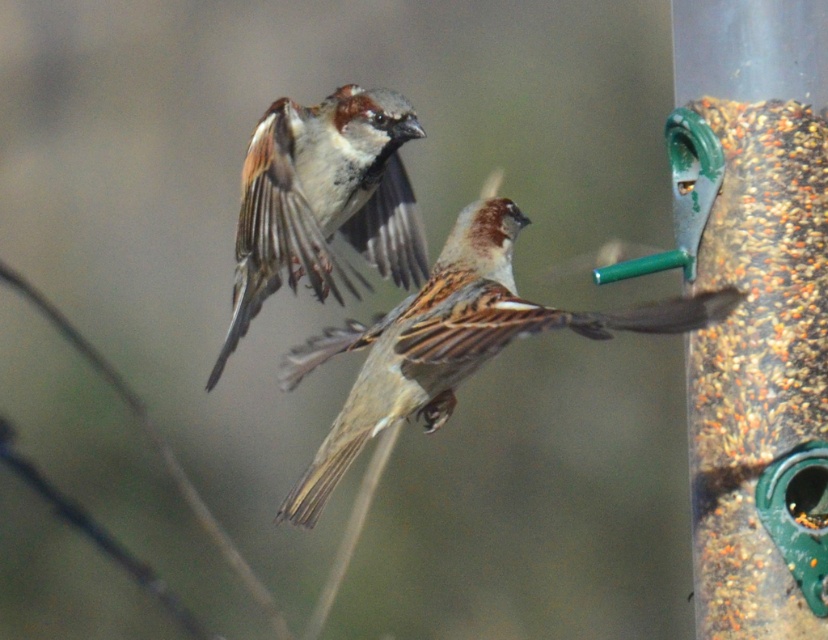
Based on the photo, between brown feathered sparrow at center and brown feathered sparrow at upper center, which one has more height?

Standing taller between the two is brown feathered sparrow at upper center.

Between point (407, 353) and point (384, 240), which one is positioned in front?

Point (407, 353)

Is point (427, 369) in front of point (302, 248)?

That is True.

I want to click on brown feathered sparrow at center, so click(451, 342).